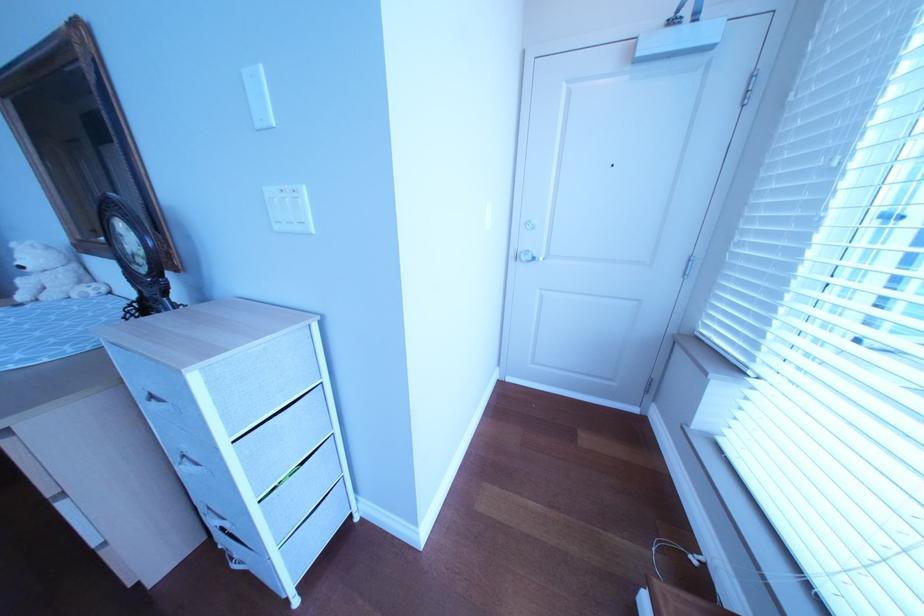
Which object does [51,274] point to?

It refers to a white teddy bear.